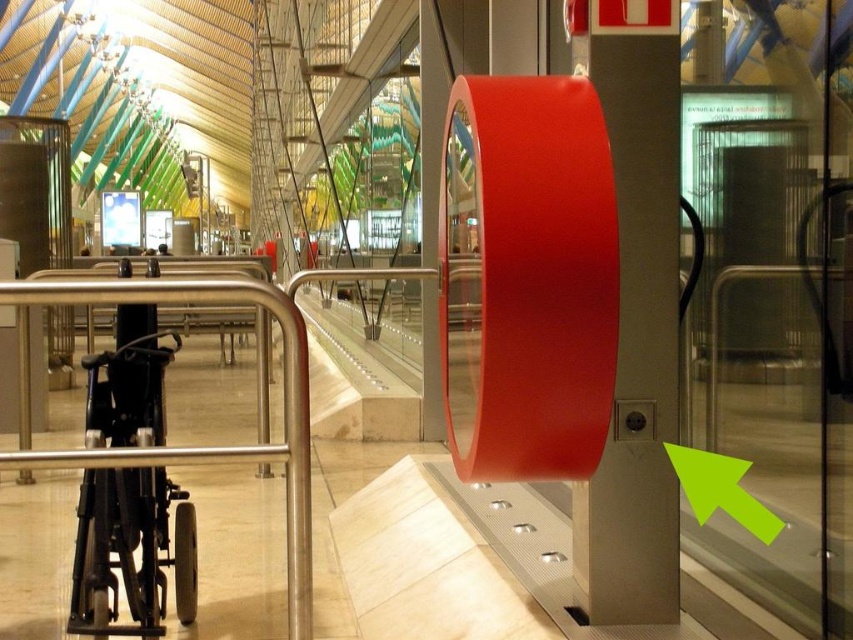
Question: Is red matte/finish pillar at center closer to the viewer compared to satin silver rail at center?

Choices:
 (A) yes
 (B) no

Answer: (B)

Question: Which object is the farthest from the red matte/finish pillar at center?

Choices:
 (A) black plastic wheelchair at left
 (B) green matte arrow at lower left

Answer: (A)

Question: Is black plastic wheelchair at left positioned behind green matte arrow at lower left?

Choices:
 (A) no
 (B) yes

Answer: (B)

Question: Which of the following is the closest to the observer?

Choices:
 (A) (665, 144)
 (B) (137, 621)
 (C) (16, 280)
 (D) (763, 541)

Answer: (C)

Question: Considering the real-world distances, which object is farthest from the red matte/finish pillar at center?

Choices:
 (A) satin silver rail at center
 (B) black plastic wheelchair at left

Answer: (B)

Question: Is red matte/finish pillar at center to the right of black plastic wheelchair at left from the viewer's perspective?

Choices:
 (A) no
 (B) yes

Answer: (B)